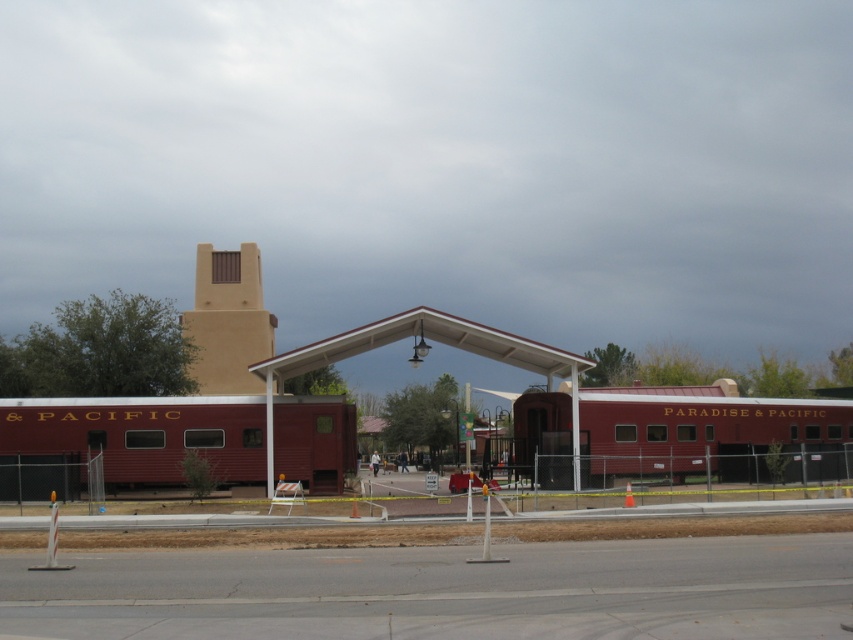
Is matte red passenger train at center smaller than matte red train car at center?

Incorrect, matte red passenger train at center is not smaller in size than matte red train car at center.

Is point (782, 451) closer to camera compared to point (328, 467)?

No, (782, 451) is further to viewer.

This screenshot has height=640, width=853. I want to click on matte red passenger train at center, so click(x=706, y=435).

Can you confirm if matte red train car at center is taller than white matte railway station at center?

In fact, matte red train car at center may be shorter than white matte railway station at center.

Does matte red train car at center have a lesser width compared to white matte railway station at center?

No.

Which is in front, point (160, 429) or point (289, 355)?

Point (289, 355)

This screenshot has height=640, width=853. What are the coordinates of `matte red train car at center` in the screenshot? It's located at (138, 435).

Which is above, matte red passenger train at center or white matte railway station at center?

white matte railway station at center is higher up.

Which of these two, matte red passenger train at center or white matte railway station at center, stands shorter?

matte red passenger train at center

Image resolution: width=853 pixels, height=640 pixels. What are the coordinates of `matte red passenger train at center` in the screenshot? It's located at (706, 435).